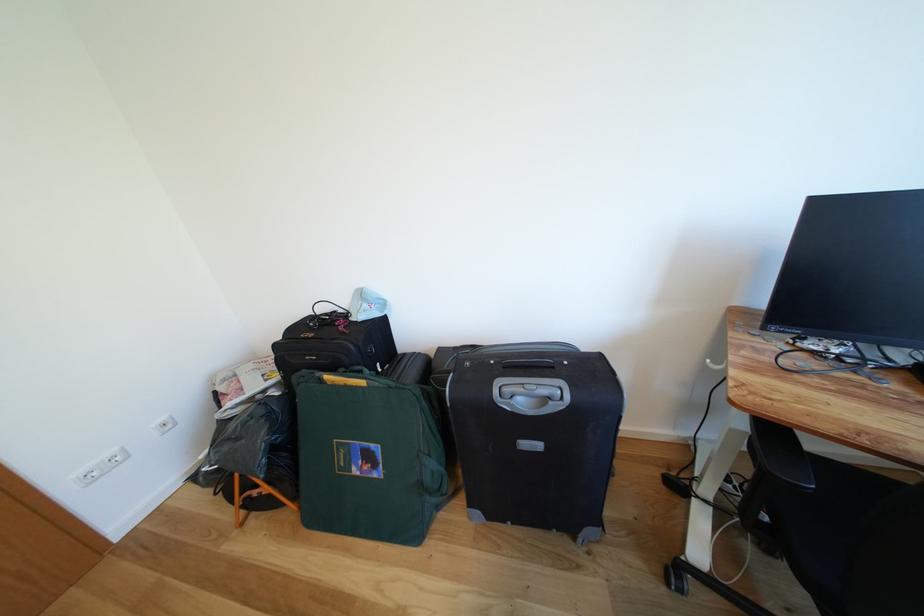
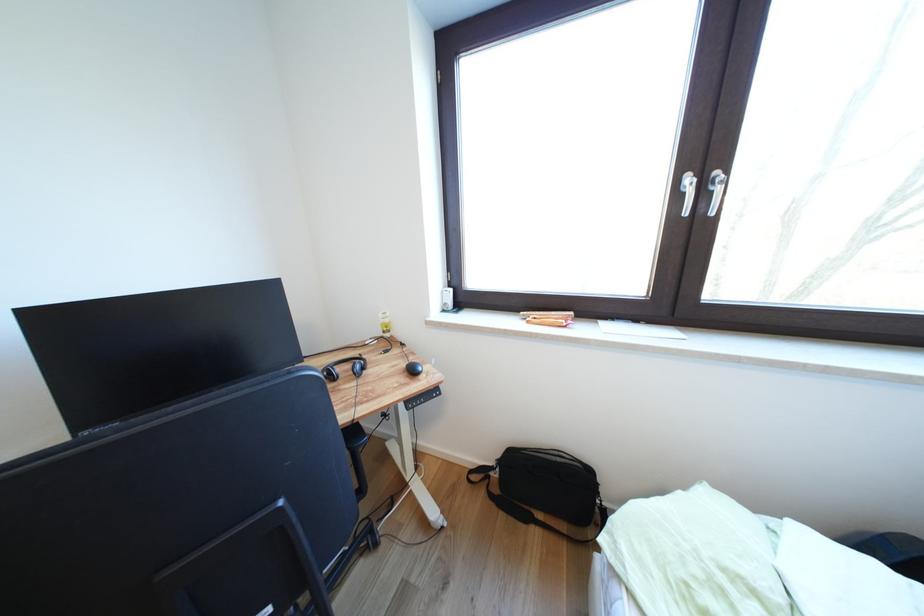
Question: The camera is either moving clockwise (left) or counter-clockwise (right) around the object. The first image is from the beginning of the video and the second image is from the end. Is the camera moving left or right when shooting the video?

Choices:
 (A) Left
 (B) Right

Answer: (A)